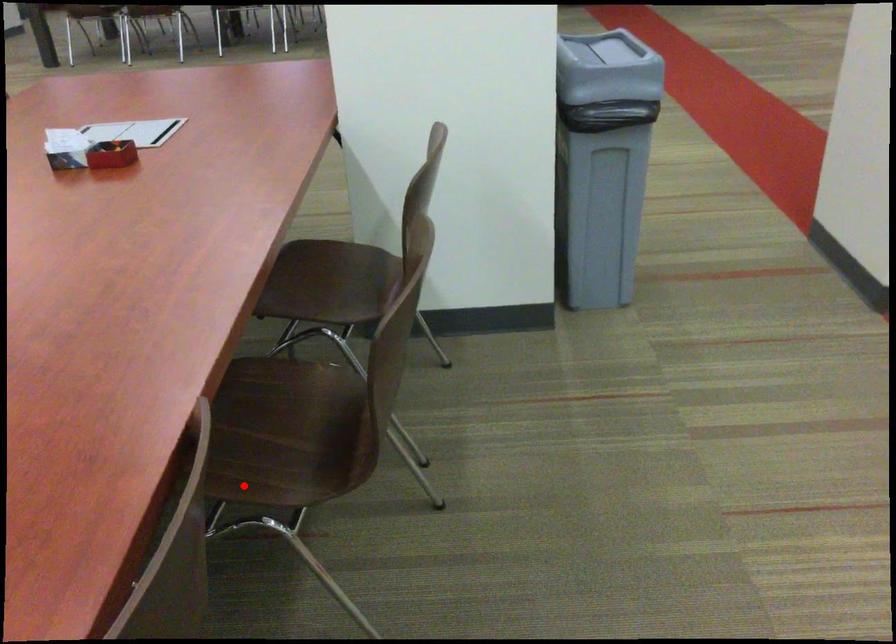
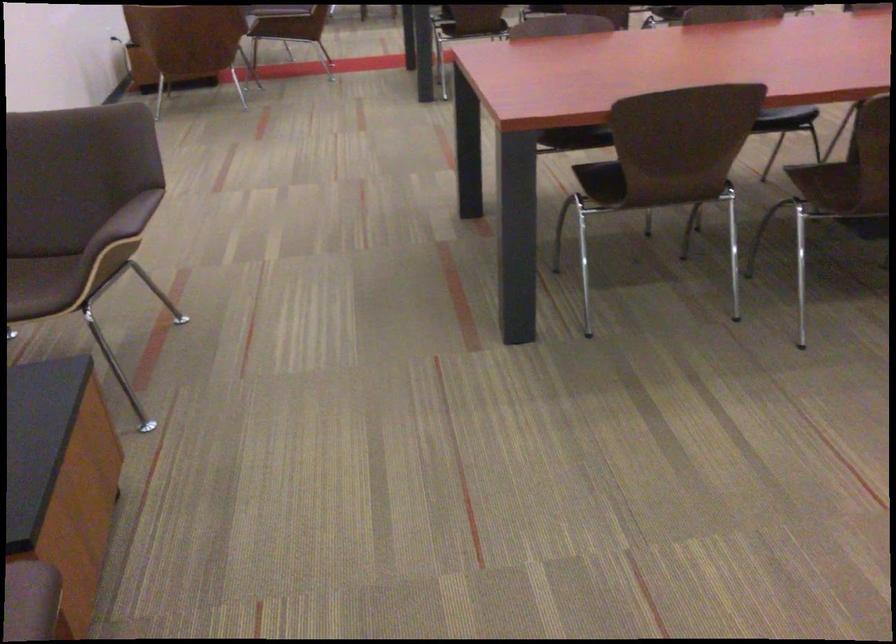
The point at the highlighted location is marked in the first image. Where is the corresponding point in the second image?

(819, 183)